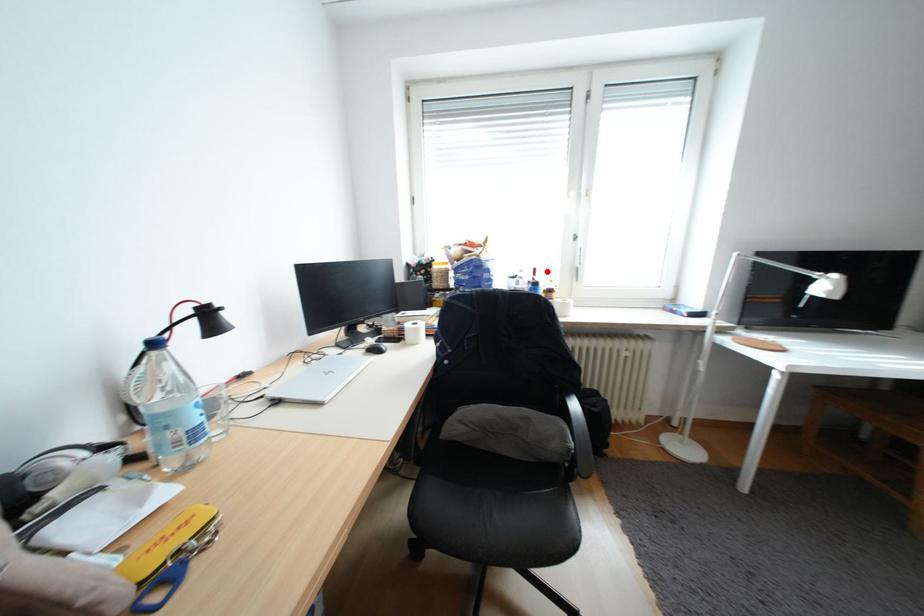
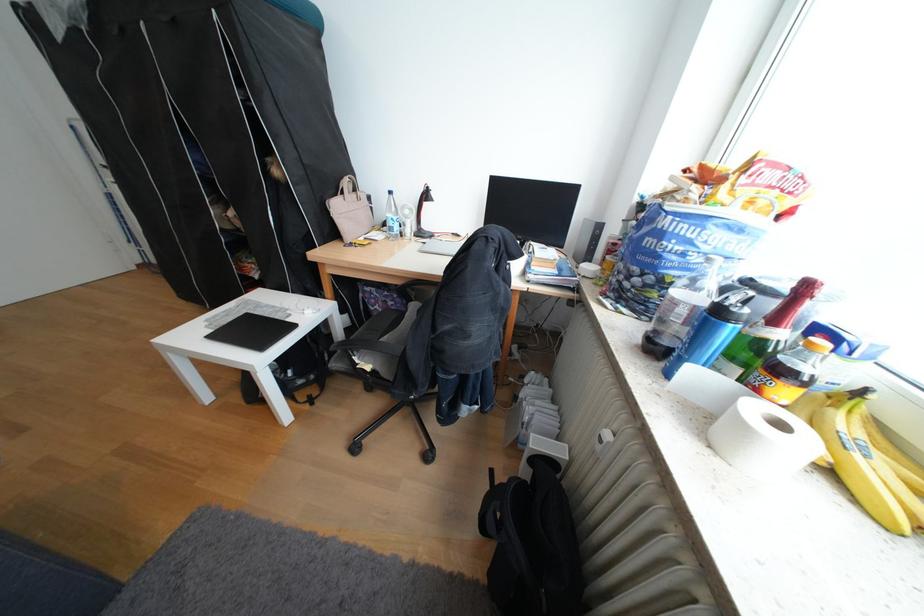
Locate, in the second image, the point that corresponds to the highlighted location in the first image.

(819, 288)